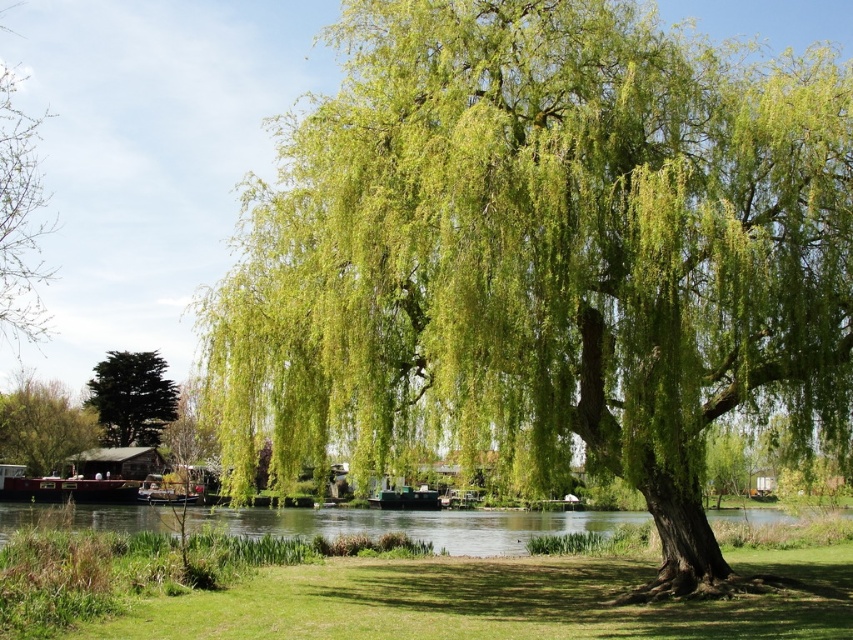
You are standing at the camera position and want to take a photo of the green leafy willow at center. If your camera has a maximum focus range of 35 feet, will you be able to capture the willow in focus?

The green leafy willow at center is 39.68 feet away from the camera, which exceeds the maximum focus range of 35 feet. Therefore, the willow will not be in focus.

You are standing at the point with coordinates point (13, 179) and want to walk to the point with coordinates point (235, 588). Which direction should you move to reach your destination?

You should move forward because point (235, 588) is behind point (13, 179), meaning it is in the direction you are facing as you stand at point (13, 179).

You are standing at the edge of the river and want to reach the green leafy tree at upper left from your current position near the green grass at lower center. Given that the distance between them is 61.25 feet, will you need to walk more than a football field length to get there?

The distance between the green grass at lower center and the green leafy tree at upper left is 61.25 feet. A football field is 300 feet long, so you do not need to walk more than a football field length to reach the tree.